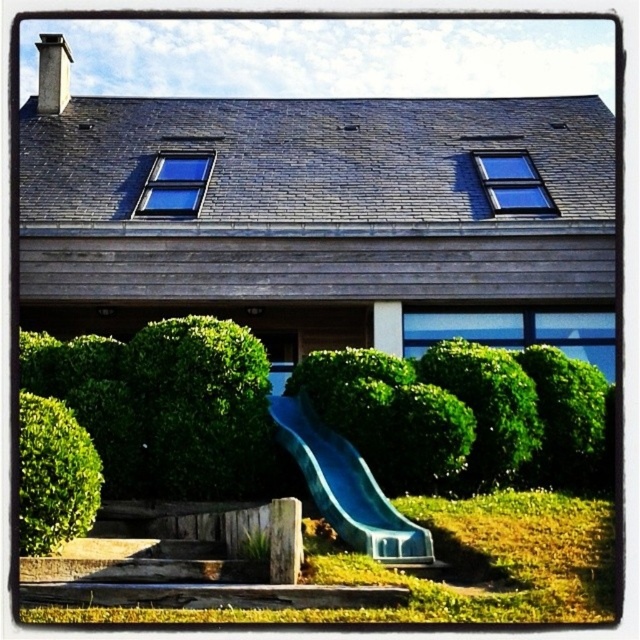
From the picture: You are a child standing in front of the house and want to play on the blue plastic slide at center. However, there is a green leafy bush at lower left in the way. Can you easily walk around it to reach the slide?

The green leafy bush at lower left is behind the blue plastic slide at center, so it is not blocking your path. You can easily walk around it to reach the blue plastic slide at center.

You are standing at the entrance of the house and want to locate the blue plastic slide at center. According to the coordinates provided, in which direction should you move to reach it?

The blue plastic slide at center is located at coordinates point (346, 486). Since the slide is at the center of the image, you should move forward from the entrance towards the center of the yard to reach it.